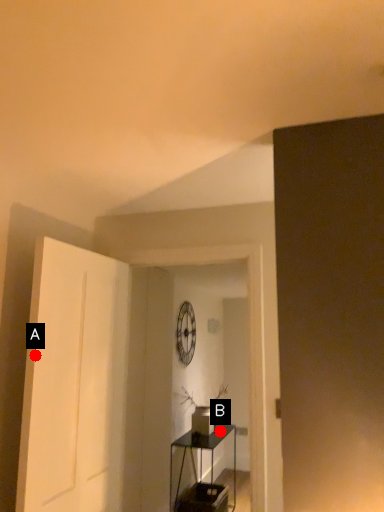
Question: Two points are circled on the image, labeled by A and B beside each circle. Which point is closer to the camera?

Choices:
 (A) A is closer
 (B) B is closer

Answer: (A)